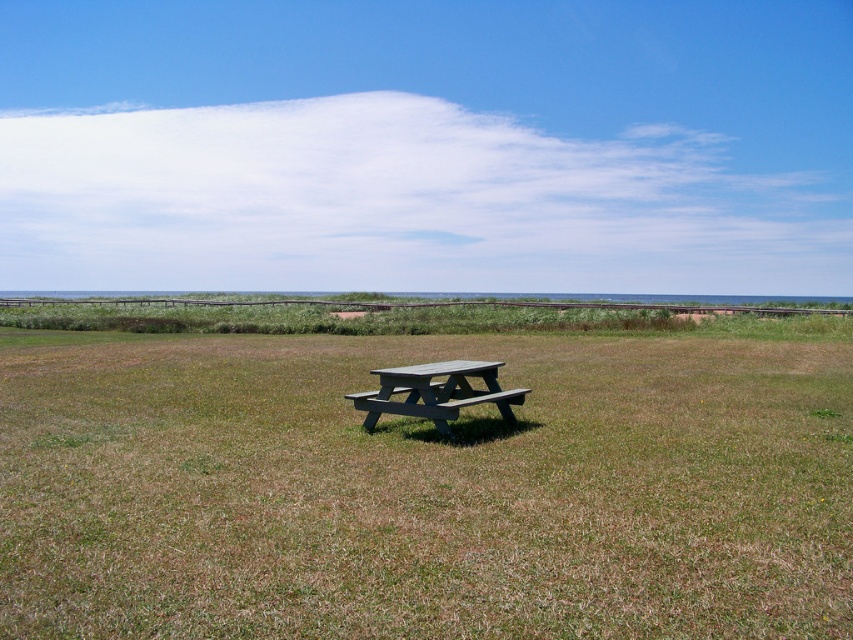
Question: Which object is farther from the camera taking this photo?

Choices:
 (A) gray wood picnic table at center
 (B) green grass at center

Answer: (A)

Question: Observing the image, what is the correct spatial positioning of green grass at center in reference to gray wood picnic table at center?

Choices:
 (A) above
 (B) below

Answer: (B)

Question: Is green grass at center smaller than gray wood picnic table at center?

Choices:
 (A) no
 (B) yes

Answer: (A)

Question: Can you confirm if green grass at center is bigger than gray wood picnic table at center?

Choices:
 (A) no
 (B) yes

Answer: (B)

Question: Which point is closer to the camera taking this photo?

Choices:
 (A) (424, 554)
 (B) (415, 401)

Answer: (A)